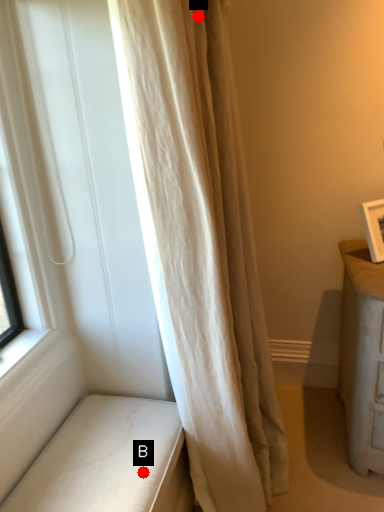
Question: Two points are circled on the image, labeled by A and B beside each circle. Among these points, which one is nearest to the camera?

Choices:
 (A) A is closer
 (B) B is closer

Answer: (A)